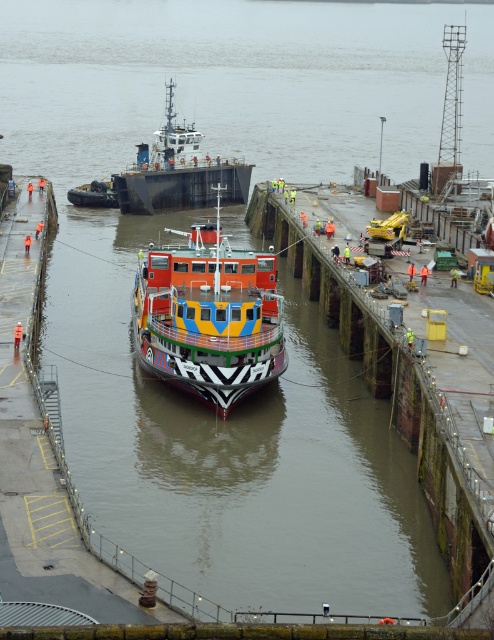
Question: Among these points, which one is nearest to the camera?

Choices:
 (A) (151, 163)
 (B) (164, 253)

Answer: (B)

Question: Is multicolored painted ship at center to the left of metallic gray barge at center from the viewer's perspective?

Choices:
 (A) yes
 (B) no

Answer: (B)

Question: Does multicolored painted ship at center lie in front of metallic gray barge at center?

Choices:
 (A) yes
 (B) no

Answer: (A)

Question: Observing the image, what is the correct spatial positioning of multicolored painted ship at center in reference to metallic gray barge at center?

Choices:
 (A) left
 (B) right

Answer: (B)

Question: Which point is farther to the camera?

Choices:
 (A) multicolored painted ship at center
 (B) metallic gray barge at center

Answer: (B)